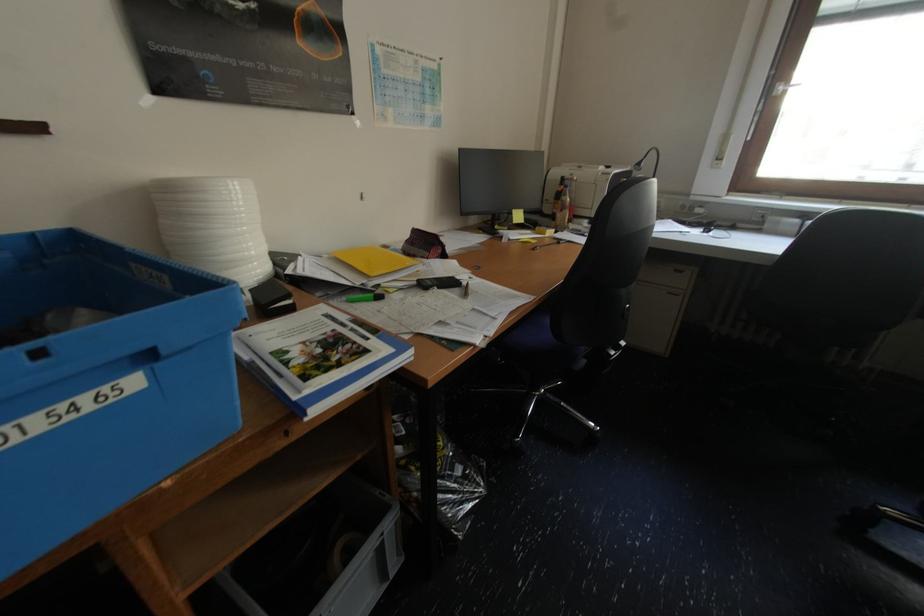
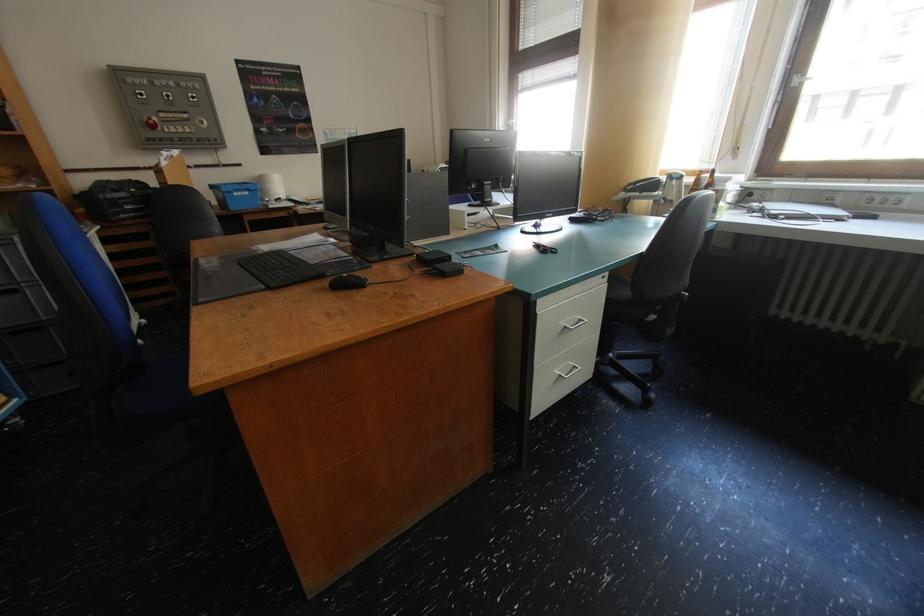
Which direction would the cameraman need to move to produce the second image?

The cameraman walked toward right, backward.